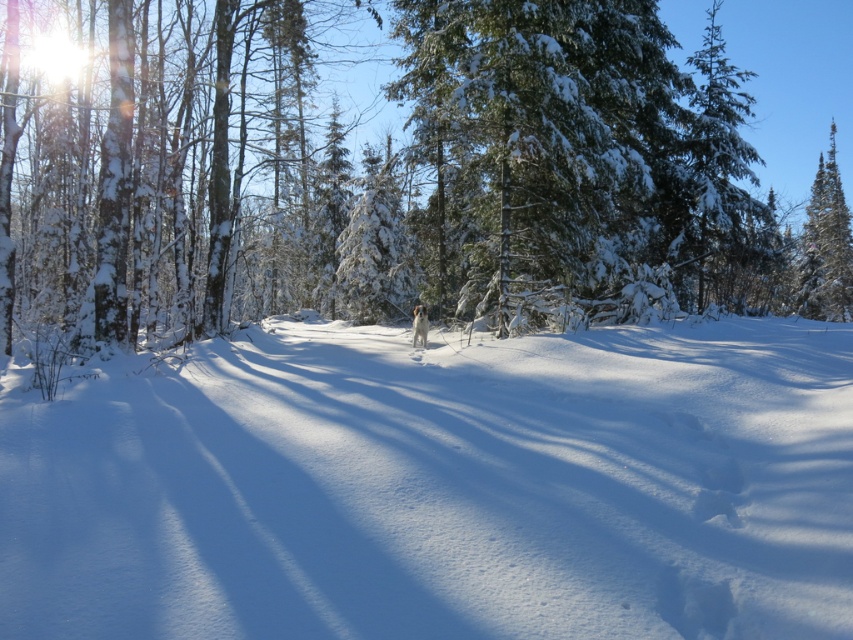
Question: Is white fluffy snow at center to the right of white fluffy dog at center from the viewer's perspective?

Choices:
 (A) no
 (B) yes

Answer: (B)

Question: Can you confirm if white fluffy snow at center is bigger than snow-covered evergreen tree at center?

Choices:
 (A) yes
 (B) no

Answer: (B)

Question: Among these objects, which one is nearest to the camera?

Choices:
 (A) snow-covered evergreen tree at center
 (B) white fluffy dog at center
 (C) white fluffy snow at center

Answer: (C)

Question: Which object is the closest to the snow-covered evergreen tree at center?

Choices:
 (A) white fluffy dog at center
 (B) white fluffy snow at center

Answer: (B)

Question: Among these objects, which one is nearest to the camera?

Choices:
 (A) snow-covered evergreen tree at center
 (B) white fluffy dog at center
 (C) white fluffy snow at center

Answer: (C)

Question: Is white fluffy snow at center to the left of white fluffy dog at center from the viewer's perspective?

Choices:
 (A) yes
 (B) no

Answer: (B)